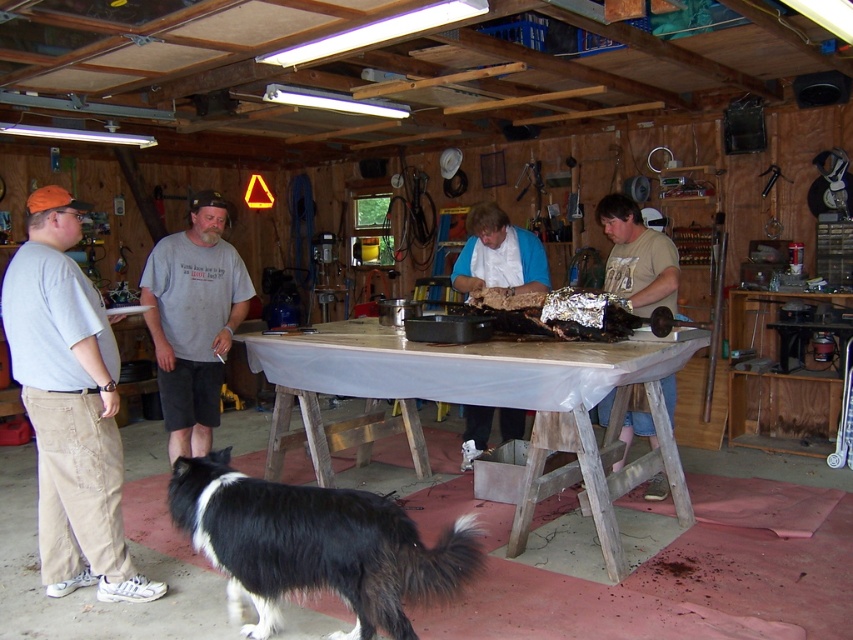
You are standing in the workshop and need to locate the gray cotton shirt at center. According to the coordinates provided, where is it positioned?

The gray cotton shirt at center is located at coordinates point (x=193, y=321).

You are trying to decide which shirt to wear for a casual day out. Both the gray cotton shirt at center and the matte brown shirt at center are options. Which one has a bigger size?

The gray cotton shirt at center is larger in size than the matte brown shirt at center, so it would be the better choice for a casual day out if you prefer a bigger size.

Based on the scene description, can you determine which object is larger between the wooden table at center and the gray cotton shirt at center?

The wooden table at center is larger than the gray cotton shirt at center according to the description.